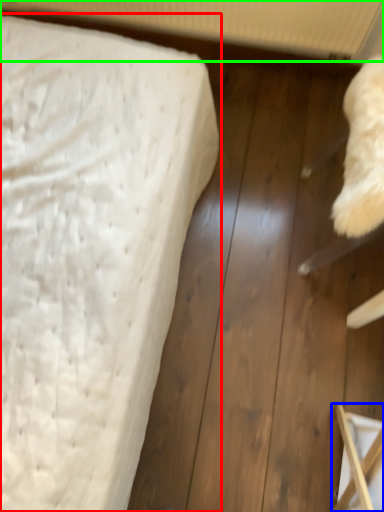
Question: Which is nearer to the bed (highlighted by a red box)? furniture (highlighted by a blue box) or radiator (highlighted by a green box).

Choices:
 (A) furniture
 (B) radiator

Answer: (A)